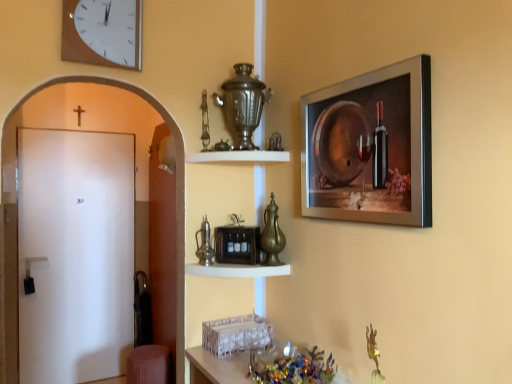
Measure the distance between gold metallic vase at center and camera.

gold metallic vase at center and camera are 1.76 meters apart.

The width and height of the screenshot is (512, 384). Describe the element at coordinates (103, 32) in the screenshot. I see `wooden clock at upper left` at that location.

Describe the element at coordinates (239, 156) in the screenshot. The height and width of the screenshot is (384, 512). I see `white glossy shelf at upper center, which appears as the first shelf when viewed from the top` at that location.

Image resolution: width=512 pixels, height=384 pixels. In order to click on white matte door at left in this screenshot , I will do `click(75, 254)`.

What is the approximate width of white matte door at left?

white matte door at left is 3.22 inches wide.

This screenshot has height=384, width=512. What do you see at coordinates (370, 147) in the screenshot?
I see `silver metallic picture frame at upper right` at bounding box center [370, 147].

Find the location of `gold metallic vase at center`. gold metallic vase at center is located at coordinates (272, 235).

At what (x,y) coordinates should I click in order to perform the action: click on clock above the metallic glass bowl at lower center (from a real-world perspective). Please return your answer as a coordinate pair (x, y). The image size is (512, 384). Looking at the image, I should click on (103, 32).

Does metallic glass bowl at lower center lie behind wooden clock at upper left?

No, it is not.

From the image's perspective, between metallic glass bowl at lower center and wooden clock at upper left, which one is located above?

wooden clock at upper left appears higher in the image.

Considering the relative sizes of metallic glass bowl at lower center and wooden clock at upper left in the image provided, is metallic glass bowl at lower center thinner than wooden clock at upper left?

No, metallic glass bowl at lower center is not thinner than wooden clock at upper left.

From a real-world perspective, which object stands above the other?

silver metallic picture frame at upper right, from a real-world perspective.

Does metallic black toaster at center, which is counted as the 1th shelf, starting from the bottom, have a smaller size compared to silver metallic picture frame at upper right?

Correct, metallic black toaster at center, which is counted as the 1th shelf, starting from the bottom, occupies less space than silver metallic picture frame at upper right.

From the image's perspective, between metallic black toaster at center, which is counted as the 1th shelf, starting from the bottom, and silver metallic picture frame at upper right, which one is located above?

silver metallic picture frame at upper right.

Is gold metallic vase at center turned away from metallic glass bowl at lower center?

No.

Between gold metallic vase at center and metallic glass bowl at lower center, which one has larger width?

Wider between the two is metallic glass bowl at lower center.

Are gold metallic vase at center and metallic glass bowl at lower center far apart?

No, gold metallic vase at center is in close proximity to metallic glass bowl at lower center.

Is gold metallic vase at center smaller than metallic glass bowl at lower center?

Yes, gold metallic vase at center is smaller than metallic glass bowl at lower center.

Consider the image. Which object is further away from the camera, metallic black toaster at center, the 2th shelf in the top-to-bottom sequence, or white glossy shelf at upper center, marked as the 2th shelf in a bottom-to-top arrangement?

Positioned behind is white glossy shelf at upper center, marked as the 2th shelf in a bottom-to-top arrangement.

Considering the sizes of objects metallic black toaster at center, the 2th shelf in the top-to-bottom sequence, and white glossy shelf at upper center, marked as the 2th shelf in a bottom-to-top arrangement, in the image provided, who is bigger, metallic black toaster at center, the 2th shelf in the top-to-bottom sequence, or white glossy shelf at upper center, marked as the 2th shelf in a bottom-to-top arrangement,?

Bigger between the two is white glossy shelf at upper center, marked as the 2th shelf in a bottom-to-top arrangement.

Measure the distance from metallic black toaster at center, the 2th shelf in the top-to-bottom sequence, to white glossy shelf at upper center, marked as the 2th shelf in a bottom-to-top arrangement.

The distance of metallic black toaster at center, the 2th shelf in the top-to-bottom sequence, from white glossy shelf at upper center, marked as the 2th shelf in a bottom-to-top arrangement, is 17.67 inches.

From the image's perspective, would you say metallic black toaster at center, which is counted as the 1th shelf, starting from the bottom, is positioned over white glossy shelf at upper center, marked as the 2th shelf in a bottom-to-top arrangement?

Incorrect, from the image's perspective, metallic black toaster at center, which is counted as the 1th shelf, starting from the bottom, is lower than white glossy shelf at upper center, marked as the 2th shelf in a bottom-to-top arrangement.

Is white matte door at left oriented towards metallic black toaster at center, which is counted as the 1th shelf, starting from the bottom?

Yes, white matte door at left faces towards metallic black toaster at center, which is counted as the 1th shelf, starting from the bottom.

Looking at this image, who is taller, white matte door at left or metallic black toaster at center, the 2th shelf in the top-to-bottom sequence?

Standing taller between the two is white matte door at left.

In the scene shown: From a real-world perspective, is white matte door at left located higher than metallic black toaster at center, which is counted as the 1th shelf, starting from the bottom?

No, from a real-world perspective, white matte door at left is not on top of metallic black toaster at center, which is counted as the 1th shelf, starting from the bottom.

Identify the location of door below the metallic black toaster at center, the 2th shelf in the top-to-bottom sequence (from the image's perspective). Image resolution: width=512 pixels, height=384 pixels. (75, 254).

Is point (203, 369) positioned after point (258, 154)?

No.

Which object is positioned more to the left, metallic glass bowl at lower center or white glossy shelf at upper center, marked as the 2th shelf in a bottom-to-top arrangement?

Positioned to the left is white glossy shelf at upper center, marked as the 2th shelf in a bottom-to-top arrangement.

What are the coordinates of `the 2nd shelf behind the metallic glass bowl at lower center` in the screenshot? It's located at (239, 156).

I want to click on shelf below the white glossy shelf at upper center, which appears as the first shelf when viewed from the top (from the image's perspective), so click(236, 270).

From a real-world perspective, is white glossy shelf at upper center, marked as the 2th shelf in a bottom-to-top arrangement, physically located above or below metallic black toaster at center, which is counted as the 1th shelf, starting from the bottom?

From a real-world perspective, white glossy shelf at upper center, marked as the 2th shelf in a bottom-to-top arrangement, is physically above metallic black toaster at center, which is counted as the 1th shelf, starting from the bottom.

Is white glossy shelf at upper center, which appears as the first shelf when viewed from the top, far away from metallic black toaster at center, which is counted as the 1th shelf, starting from the bottom?

That's not correct — white glossy shelf at upper center, which appears as the first shelf when viewed from the top, is a little close to metallic black toaster at center, which is counted as the 1th shelf, starting from the bottom.

Does white glossy shelf at upper center, which appears as the first shelf when viewed from the top, come behind metallic black toaster at center, the 2th shelf in the top-to-bottom sequence?

That is True.

I want to click on clock behind the metallic glass bowl at lower center, so click(x=103, y=32).

In order to click on shelf that is below the silver metallic picture frame at upper right (from the image's perspective) in this screenshot , I will do `click(236, 270)`.

When comparing their distances from white matte door at left, does metallic black toaster at center, which is counted as the 1th shelf, starting from the bottom, or silver metallic picture frame at upper right seem closer?

Among the two, metallic black toaster at center, which is counted as the 1th shelf, starting from the bottom, is located nearer to white matte door at left.

Considering their positions, is metallic black toaster at center, the 2th shelf in the top-to-bottom sequence, positioned further to gold metallic vase at center than wooden clock at upper left?

wooden clock at upper left.

Which object lies further to the anchor point metallic glass bowl at lower center, white matte door at left or metallic black toaster at center, the 2th shelf in the top-to-bottom sequence?

The object further to metallic glass bowl at lower center is white matte door at left.

Which object lies further to the anchor point metallic black toaster at center, the 2th shelf in the top-to-bottom sequence, white matte door at left or white glossy shelf at upper center, which appears as the first shelf when viewed from the top?

white matte door at left is further to metallic black toaster at center, the 2th shelf in the top-to-bottom sequence.

From the image, which object appears to be nearer to wooden clock at upper left, white glossy shelf at upper center, which appears as the first shelf when viewed from the top, or silver metallic picture frame at upper right?

white glossy shelf at upper center, which appears as the first shelf when viewed from the top.

From the image, which object appears to be farther from silver metallic picture frame at upper right, white matte door at left or gold metallic vase at center?

white matte door at left is positioned further to the anchor silver metallic picture frame at upper right.

Based on their spatial positions, is silver metallic picture frame at upper right or wooden clock at upper left further from gold metallic vase at center?

wooden clock at upper left is positioned further to the anchor gold metallic vase at center.

From the image, which object appears to be nearer to silver metallic picture frame at upper right, metallic glass bowl at lower center or white matte door at left?

metallic glass bowl at lower center lies closer to silver metallic picture frame at upper right than the other object.

In order to click on picture frame that lies between wooden clock at upper left and metallic black toaster at center, the 2th shelf in the top-to-bottom sequence, from top to bottom in this screenshot , I will do `click(370, 147)`.

This screenshot has height=384, width=512. Find the location of `glass vase located between white glossy shelf at upper center, which appears as the first shelf when viewed from the top, and white matte door at left in the depth direction`. glass vase located between white glossy shelf at upper center, which appears as the first shelf when viewed from the top, and white matte door at left in the depth direction is located at coordinates (272, 235).

You are a GUI agent. You are given a task and a screenshot of the screen. Output one action in this format:
    pyautogui.click(x=<x>, y=<y>)
    Task: Click on the clock located between silver metallic picture frame at upper right and white matte door at left in the depth direction
    Image resolution: width=512 pixels, height=384 pixels.
    Given the screenshot: What is the action you would take?
    (103, 32)

This screenshot has width=512, height=384. What are the coordinates of `shelf between wooden clock at upper left and metallic black toaster at center, the 2th shelf in the top-to-bottom sequence, in the vertical direction` in the screenshot? It's located at (239, 156).